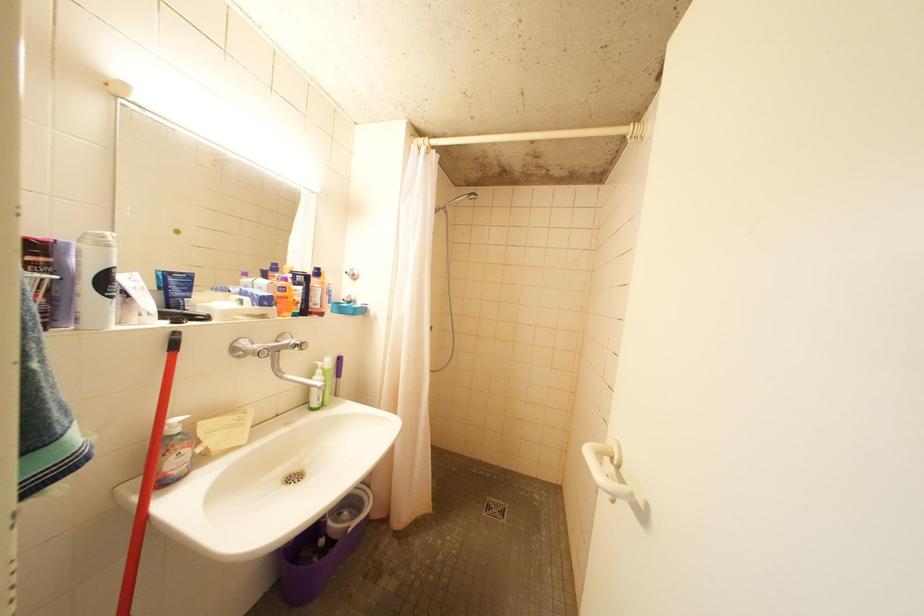
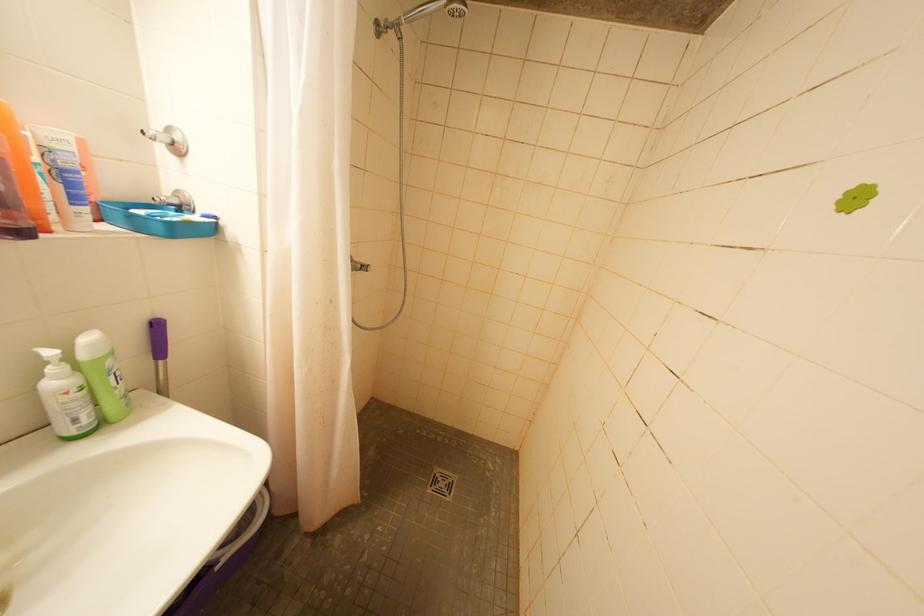
Question: What movement of the cameraman would produce the second image?

Choices:
 (A) Left
 (B) Right
 (C) Forward
 (D) Backward

Answer: (C)